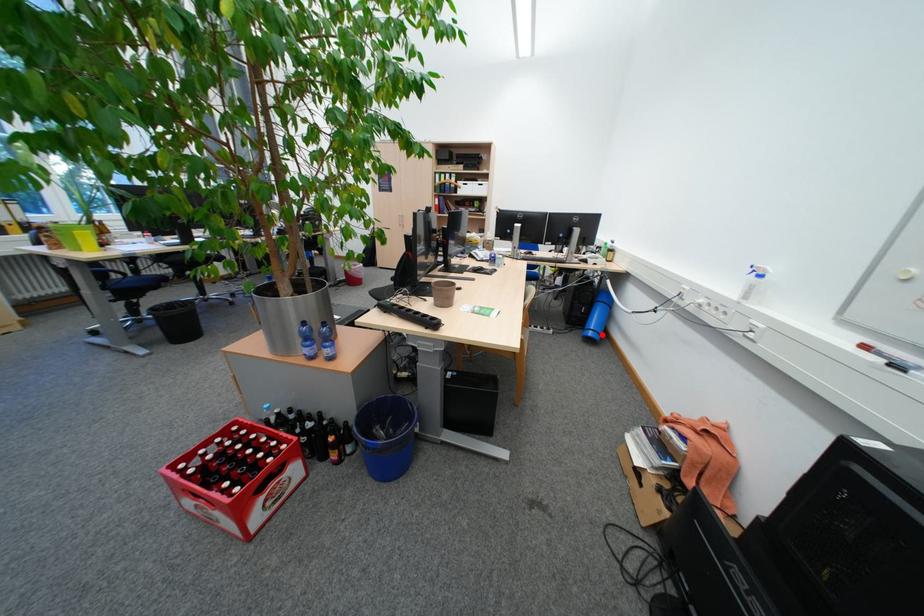
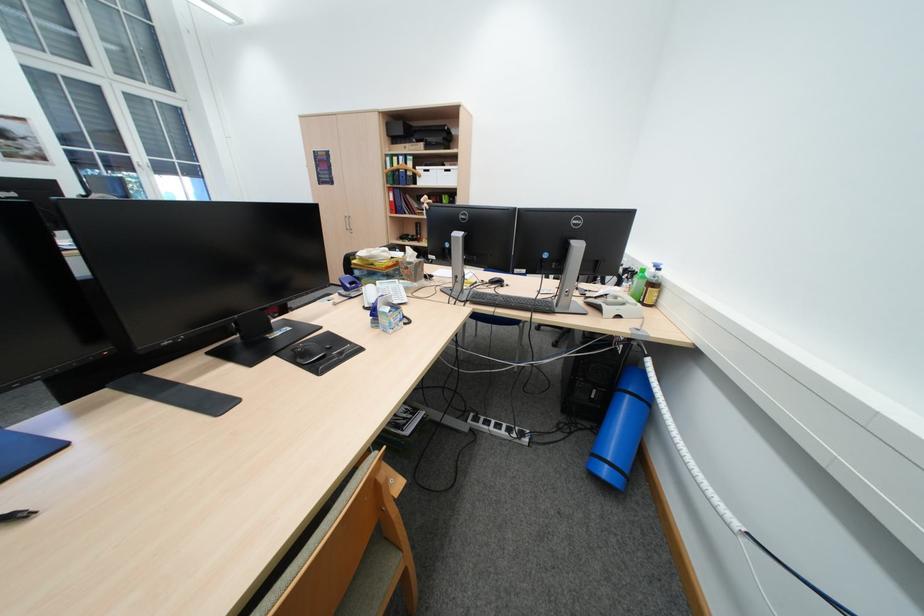
In the second image, find the point that corresponds to the highlighted location in the first image.

(616, 472)